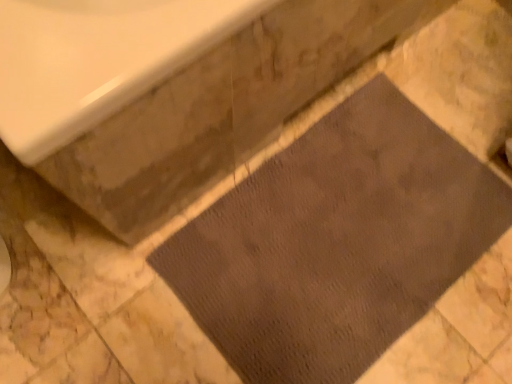
The height and width of the screenshot is (384, 512). What are the coordinates of `blank space situated above brown textured mat at center (from a real-world perspective)` in the screenshot? It's located at (348, 231).